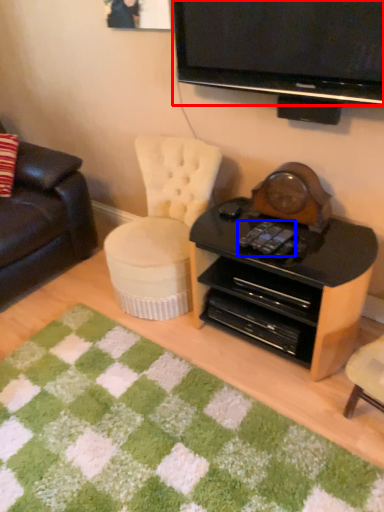
Question: Which point is closer to the camera, television (highlighted by a red box) or remote control (highlighted by a blue box)?

Choices:
 (A) television
 (B) remote control

Answer: (A)